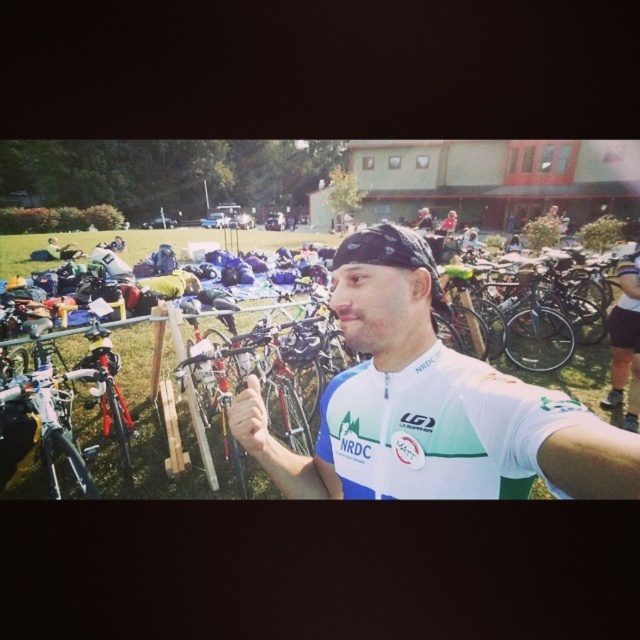
You are standing in the middle of the scene and want to reach both the point at coordinates (253, 385) and the point at coordinates (284, 339). Which point should you reach first?

You should reach the point at coordinates (253, 385) first because it is closer to you than the point at coordinates (284, 339).

You are a photographer at the event and want to capture a photo of the white jersey at center and the white matte hand at center. Based on their positions, which object is on the left side in the image?

The white matte hand at center is on the left side because the white jersey at center is to the right of it.